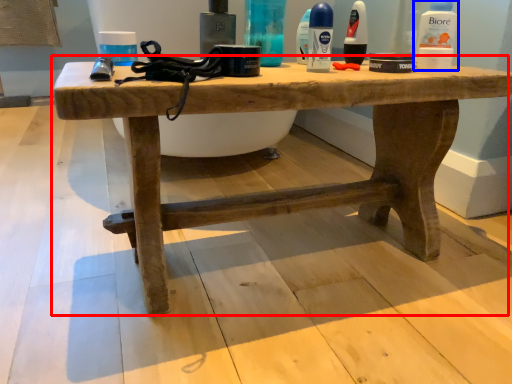
Question: Which object appears closest to the camera in this image, table (highlighted by a red box) or mouthwash (highlighted by a blue box)?

Choices:
 (A) table
 (B) mouthwash

Answer: (A)